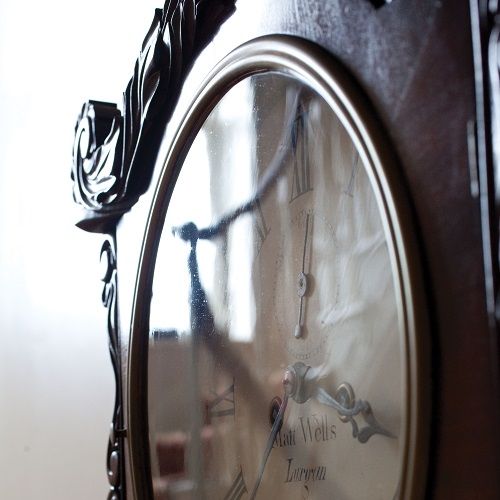
Image resolution: width=500 pixels, height=500 pixels. Find the location of `wooden parts of clock`. wooden parts of clock is located at coordinates (444, 253), (393, 54), (106, 149), (240, 23), (121, 377), (110, 261), (117, 469), (456, 455).